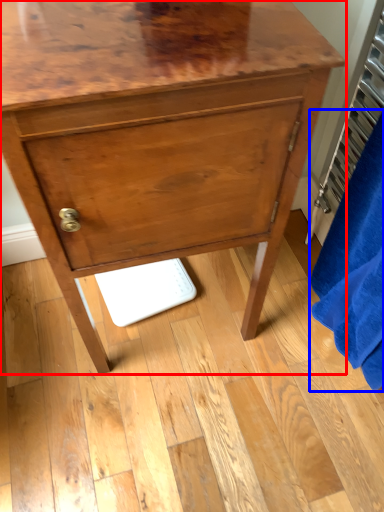
Question: Which point is closer to the camera, chest of drawers (highlighted by a red box) or bath towel (highlighted by a blue box)?

Choices:
 (A) chest of drawers
 (B) bath towel

Answer: (B)